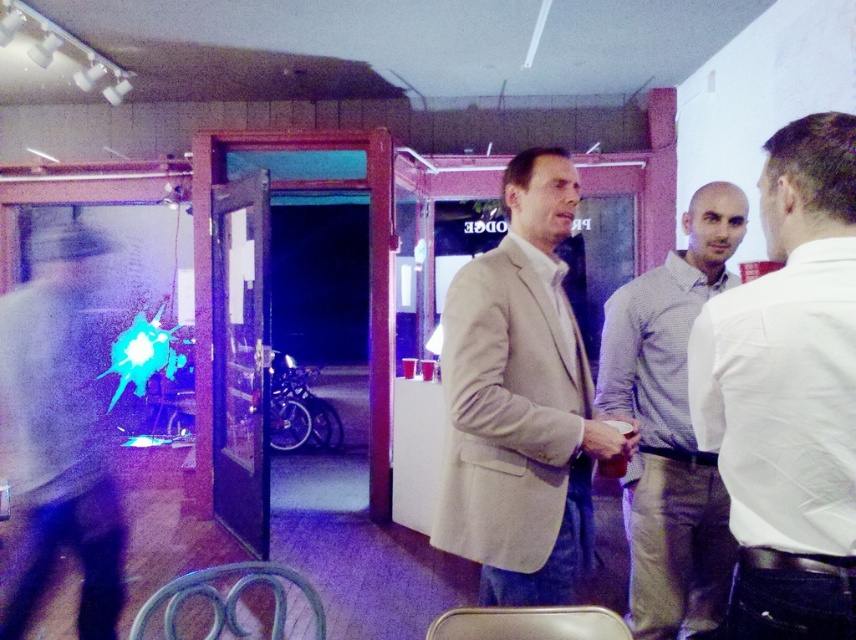
Based on the photo, you are a photographer setting up for an event. You need to position a light stand between the light beige suit at center and the matte black jacket at left to ensure even lighting. The light stand requires at least 1.5 meters of space to be safely placed. Can the light stand be placed between them?

The distance between the light beige suit at center and the matte black jacket at left is 1.55 meters, which is just enough to accommodate the light stand requiring at least 1.5 meters of space. Yes, the light stand can be placed between them safely.

You are a photographer setting up for a group photo. You need to ensure that the light beige suit at center and the checkered shirt at center are both in focus. The depth of field you can achieve is 20 inches. Will you need to adjust your camera settings to capture both subjects clearly?

The distance between the light beige suit at center and the checkered shirt at center is 21.69 inches. Since the depth of field is only 20 inches, you will need to adjust your camera settings to ensure both are in focus.

You are taking a photo of the scene and want to focus on both the point at coordinates point (716, 406) and point (627, 502). Since the camera can only focus on one depth at a time, which point should you focus on to ensure at least one of them is in focus?

You should focus on point (716, 406) because it is closer to the camera than point (627, 502). This way, the closer point will be in focus, and the farther point may still be within the depth of field.